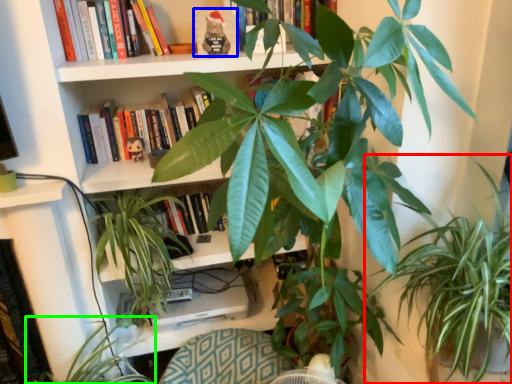
Question: Which is nearer to the houseplant (highlighted by a red box)? paperback book (highlighted by a blue box) or houseplant (highlighted by a green box).

Choices:
 (A) paperback book
 (B) houseplant

Answer: (A)